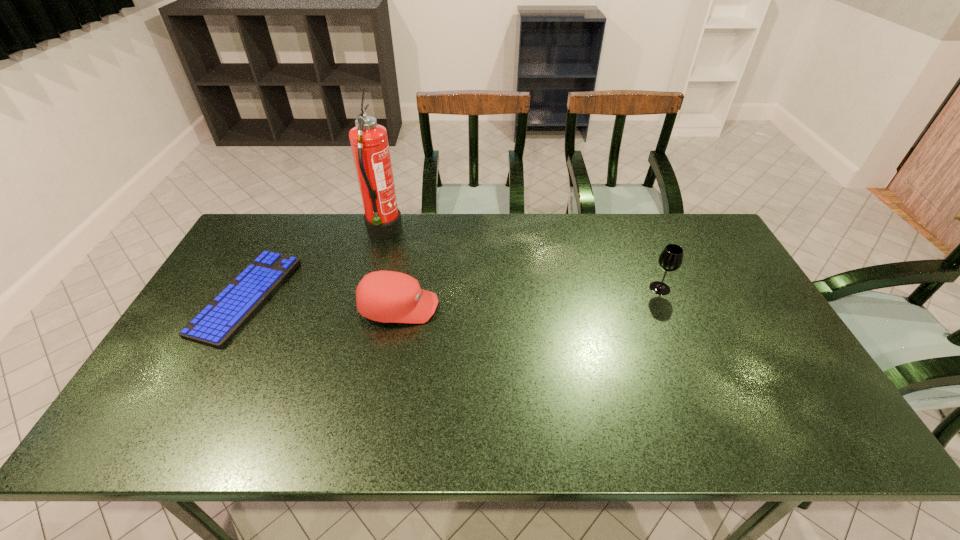
Identify the location of vacant space situated on the right of the shortest object. (405, 297).

Where is `fire extinguisher that is at the far edge`? The image size is (960, 540). fire extinguisher that is at the far edge is located at coordinates (369, 142).

Identify the location of computer keyboard located in the far edge section of the desktop. (217, 323).

Where is `object situated at the left edge`? Image resolution: width=960 pixels, height=540 pixels. object situated at the left edge is located at coordinates (217, 323).

This screenshot has width=960, height=540. What are the coordinates of `object present at the far left corner` in the screenshot? It's located at (217, 323).

This screenshot has width=960, height=540. What are the coordinates of `vacant space at the far edge of the desktop` in the screenshot? It's located at 371,238.

Where is `vacant space at the near edge of the desktop`? vacant space at the near edge of the desktop is located at coordinates (711, 412).

Locate an element on the screen. free space at the right edge is located at coordinates (748, 315).

Find the location of a particular element. vacant space at the far left corner of the desktop is located at coordinates (278, 219).

Identify the location of blank region between the rightmost object and the second shortest object. (529, 298).